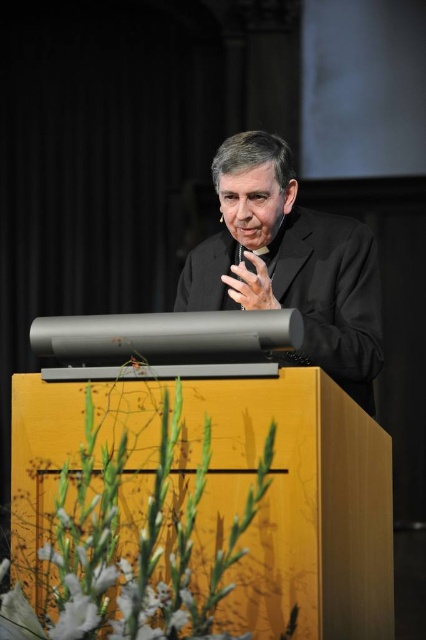
Looking at this image, you are an event planner setting up a stage for a presentation. You have a yellow wood podium at center and a black matte suit at center. Which object should you place first to ensure proper positioning?

The yellow wood podium at center should be placed first since it is larger in size than the black matte suit at center, making it easier to position the smaller item around it.

You are an event planner arranging the stage for a presentation. The speaker will stand at the yellow wood podium at center and wear the black matte suit at center. Based on the scene description, where should you position the floral arrangement to ensure it is visible to the audience but not blocking the speaker?

The yellow wood podium at center is located below the black matte suit at center, so positioning the floral arrangement in front of the podium would keep it visible to the audience while avoiding obstruction of the speaker in the black matte suit at center.

You are standing in front of the podium and want to place a small note exactly at the point marked as point (290, 506). Based on the description, where on the yellow wood podium at center should you place the note?

The point (290, 506) is located on the yellow wood podium at center, so you should place the note there.